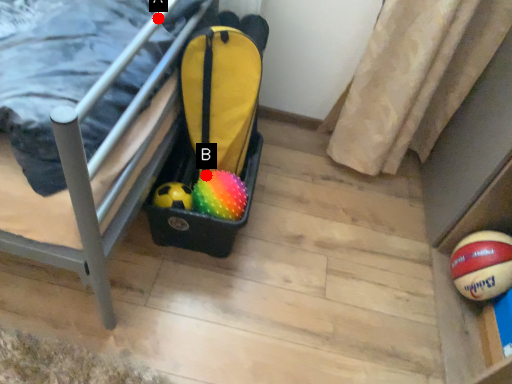
Question: Two points are circled on the image, labeled by A and B beside each circle. Which point appears farthest from the camera in this image?

Choices:
 (A) A is further
 (B) B is further

Answer: (B)